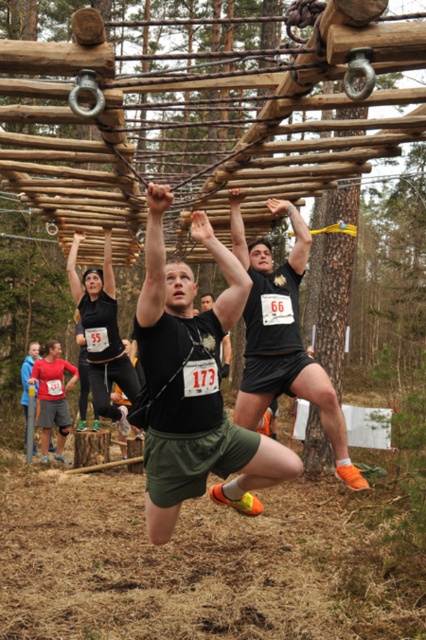
You are a photographer standing at the starting line of the obstacle course. You want to capture a photo of the black matte shirt at center participant. If your camera has a maximum focus range of 3 meters, will you be able to clearly capture the participant?

The black matte shirt at center is 3.41 meters away from the viewer. Since the camera can only focus up to 3 meters, it will not be able to clearly capture the participant.

You are a photographer positioned at the edge of the obstacle course. You need to capture a photo where both the black matte shirt at center and the matte black shorts at center are clearly visible. Given their current distance apart, will the camera focus on both objects simultaneously?

The black matte shirt at center is 35.91 inches from the matte black shorts at center. Since the distance between them is relatively small, the camera should be able to focus on both objects simultaneously as they are within a reasonable focal range.

You are a photographer positioned at the edge of the obstacle course. You need to capture a closeup shot of the participant wearing the black matte shirt at center and the matte black shorts at center. Which clothing item will appear wider in the photo?

The black matte shirt at center will appear wider in the photo since its width is larger than that of the matte black shorts at center.